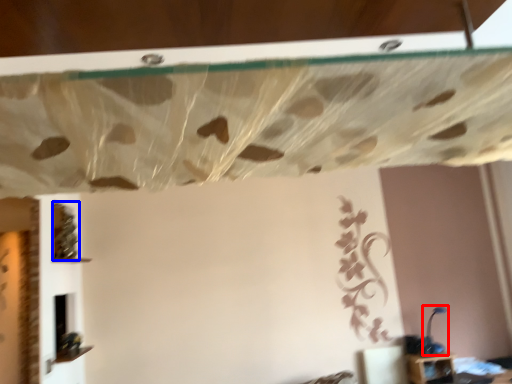
Question: Which object appears closest to the camera in this image, lamp (highlighted by a red box) or vine (highlighted by a blue box)?

Choices:
 (A) lamp
 (B) vine

Answer: (B)